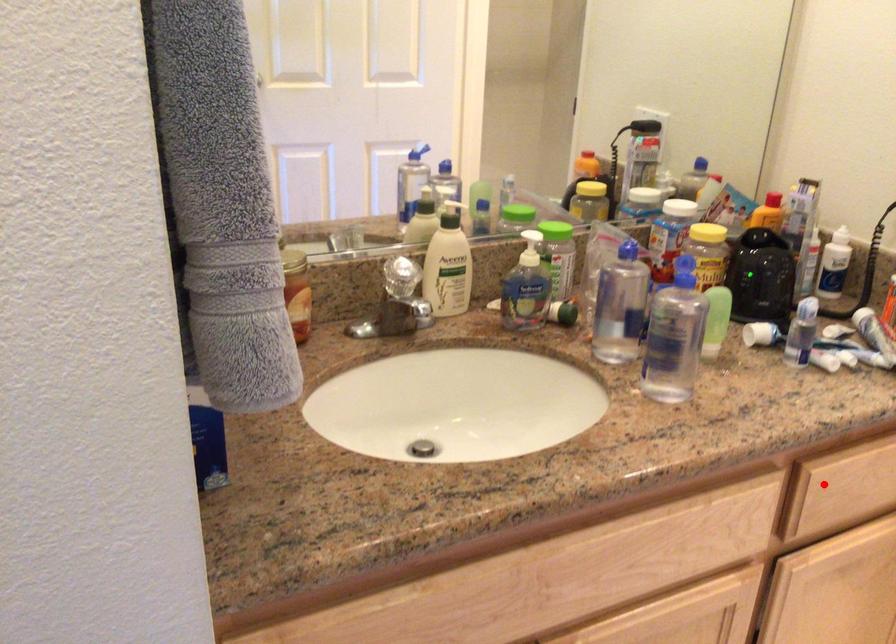
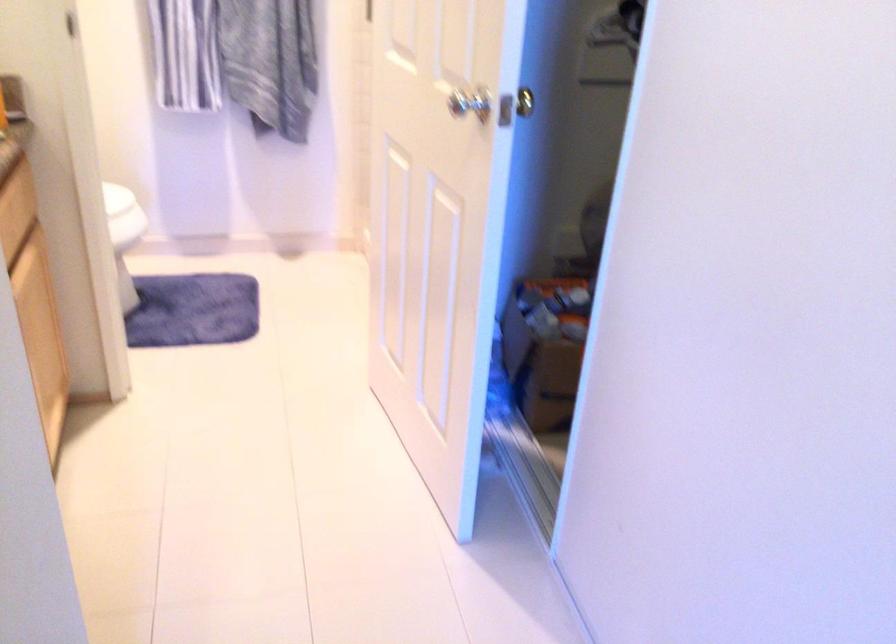
Question: I am providing you with two images of the same scene from different viewpoints. Image1 has a red point marked. In image2, the corresponding 3D location appears at what relative position? Reply with the corresponding letter.

Choices:
 (A) Closer
 (B) Farther

Answer: (B)